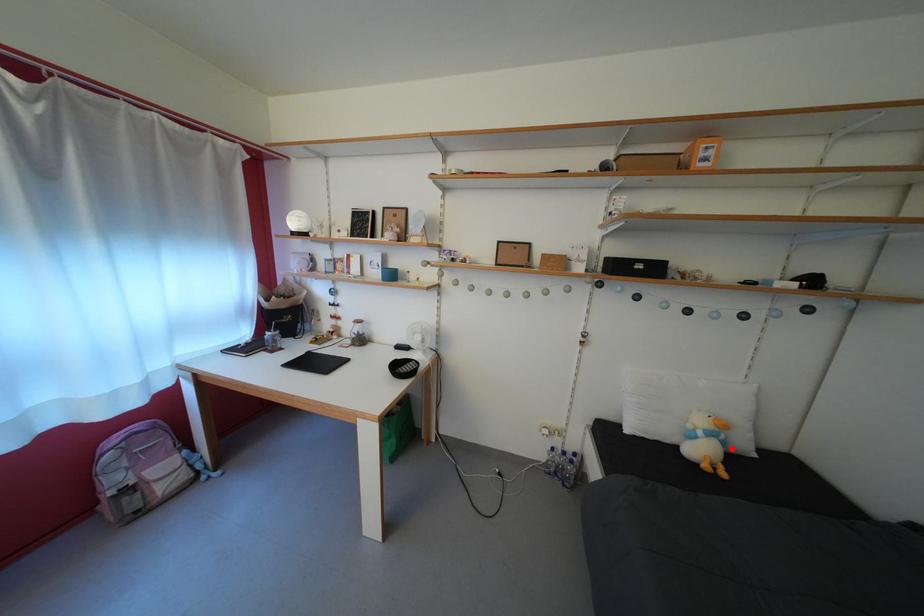
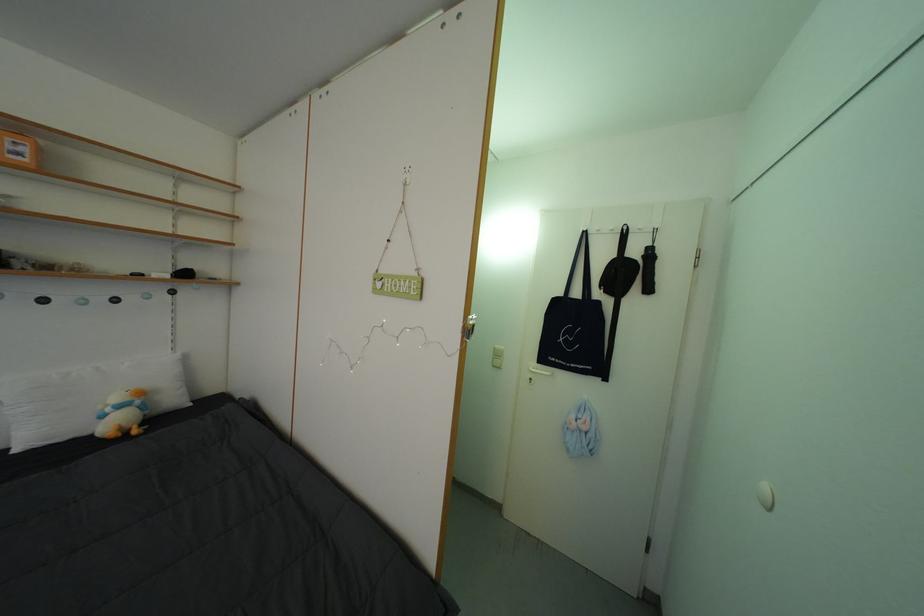
Locate, in the second image, the point that corresponds to the highlighted location in the first image.

(152, 413)